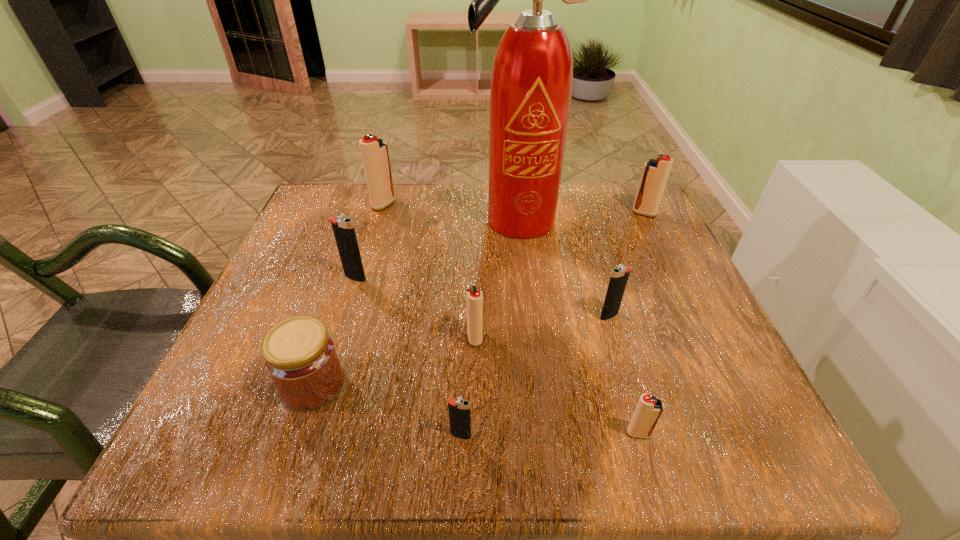
Find the location of a particular element. object that is at the right edge is located at coordinates (655, 173).

The height and width of the screenshot is (540, 960). I want to click on object located in the far left corner section of the desktop, so click(x=374, y=151).

The height and width of the screenshot is (540, 960). I want to click on object located in the near left corner section of the desktop, so click(x=300, y=356).

The height and width of the screenshot is (540, 960). Identify the location of object positioned at the far right corner. (655, 173).

Image resolution: width=960 pixels, height=540 pixels. In order to click on free region at the far edge in this screenshot , I will do `click(429, 225)`.

You are a GUI agent. You are given a task and a screenshot of the screen. Output one action in this format:
    pyautogui.click(x=<x>, y=<y>)
    Task: Click on the vacant region at the near edge of the desktop
    The height and width of the screenshot is (540, 960).
    Given the screenshot: What is the action you would take?
    pyautogui.click(x=445, y=455)

At what (x,y) coordinates should I click in order to perform the action: click on free location at the left edge. Please return your answer as a coordinate pair (x, y). Image resolution: width=960 pixels, height=540 pixels. Looking at the image, I should click on (217, 396).

The width and height of the screenshot is (960, 540). Identify the location of free space at the right edge. (660, 390).

At what (x,y) coordinates should I click in order to perform the action: click on free location at the far left corner of the desktop. Please return your answer as a coordinate pair (x, y). The image size is (960, 540). Looking at the image, I should click on (331, 208).

In the image, there is a desktop. At what (x,y) coordinates should I click in order to perform the action: click on vacant region at the far right corner. Please return your answer as a coordinate pair (x, y). This screenshot has width=960, height=540. Looking at the image, I should click on (626, 223).